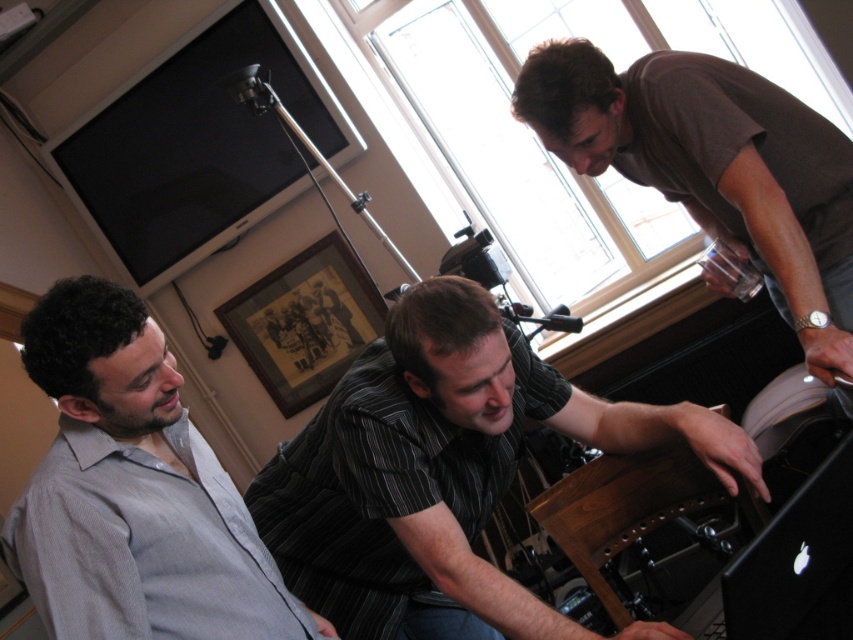
Which is in front, point (36, 582) or point (820, 605)?

Point (36, 582) is in front.

Between point (44, 529) and point (788, 596), which one is positioned behind?

Positioned behind is point (44, 529).

Where is `gray striped shirt at left`? This screenshot has width=853, height=640. gray striped shirt at left is located at coordinates (134, 492).

Find the location of a particular element. gray striped shirt at left is located at coordinates (134, 492).

Who is positioned more to the right, striped cotton shirt at center or brown cotton shirt at upper right?

brown cotton shirt at upper right is more to the right.

Can you confirm if striped cotton shirt at center is wider than brown cotton shirt at upper right?

Indeed, striped cotton shirt at center has a greater width compared to brown cotton shirt at upper right.

Identify the location of striped cotton shirt at center. Image resolution: width=853 pixels, height=640 pixels. (442, 467).

Where is `striped cotton shirt at center`? striped cotton shirt at center is located at coordinates (442, 467).

Does gray striped shirt at left have a smaller size compared to brown cotton shirt at upper right?

Correct, gray striped shirt at left occupies less space than brown cotton shirt at upper right.

Is point (36, 376) in front of point (798, 102)?

Yes, point (36, 376) is closer to viewer.

I want to click on gray striped shirt at left, so click(x=134, y=492).